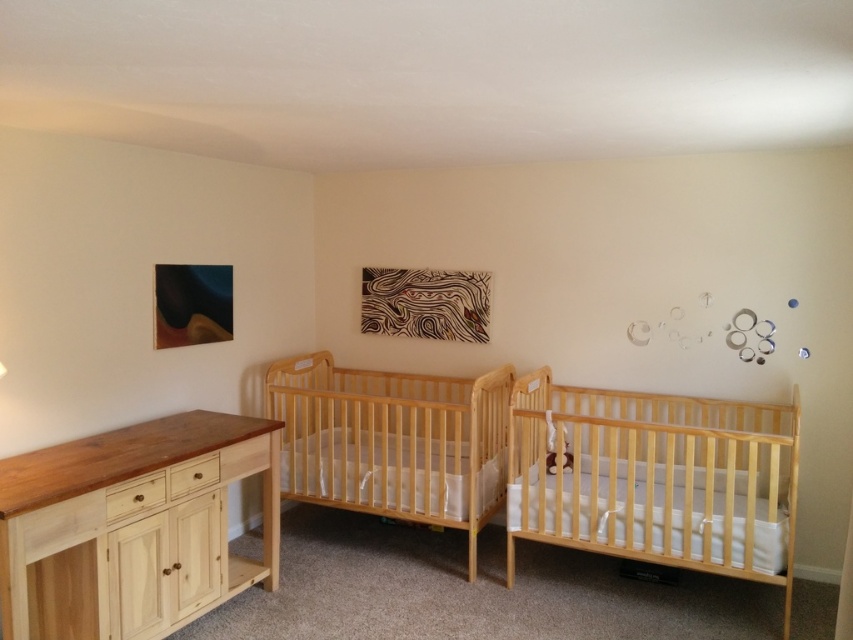
Question: Can you confirm if natural wood crib at right is wider than white painted wood drawer at lower left?

Choices:
 (A) no
 (B) yes

Answer: (B)

Question: Among these points, which one is farthest from the camera?

Choices:
 (A) (202, 483)
 (B) (259, 436)
 (C) (271, 588)
 (D) (137, 509)

Answer: (C)

Question: Does natural wood crib at right have a smaller size compared to white painted wood drawer at lower left?

Choices:
 (A) yes
 (B) no

Answer: (B)

Question: Which point appears closest to the camera in this image?

Choices:
 (A) (173, 442)
 (B) (264, 449)

Answer: (A)

Question: Can you confirm if natural wood crib at right is positioned to the left of light wood changing table at left?

Choices:
 (A) no
 (B) yes

Answer: (A)

Question: Which of the following is the closest to the observer?

Choices:
 (A) tap(612, 532)
 (B) tap(173, 476)
 (C) tap(416, 470)
 (D) tap(271, 552)

Answer: (B)